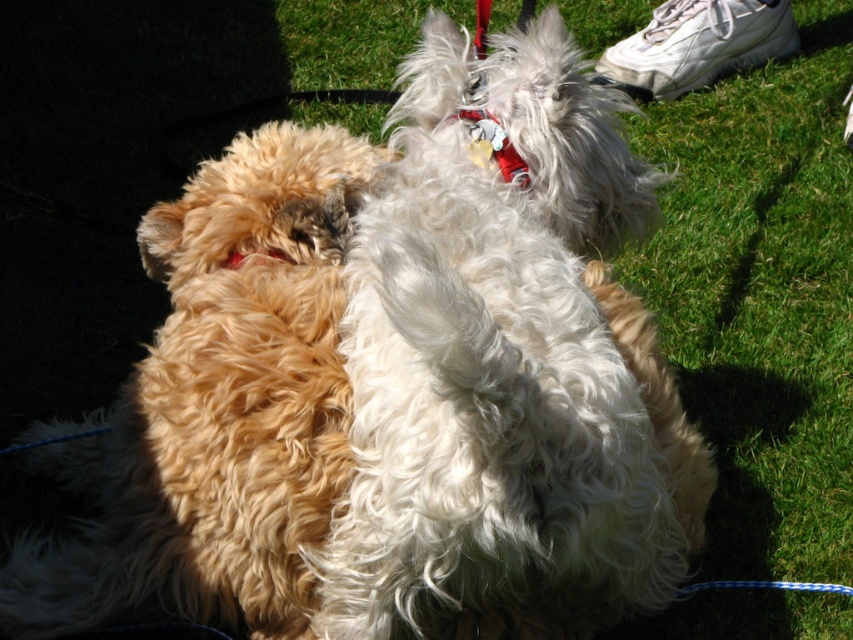
You are a dog owner trying to identify which object is bigger between the fluffy golden fur at center and the red fabric collar at center. Based on the scene, which one is larger?

The fluffy golden fur at center is larger in size than the red fabric collar at center.

You are a photographer setting up a shot of the two dogs. You need to ensure that the fluffy golden fur at center is visible above the green grass at center. Based on the scene description, is this possible?

The fluffy golden fur at center has a lesser height compared to the green grass at center, so it cannot be visible above the green grass at center unless the camera angle is adjusted to lower the perspective.